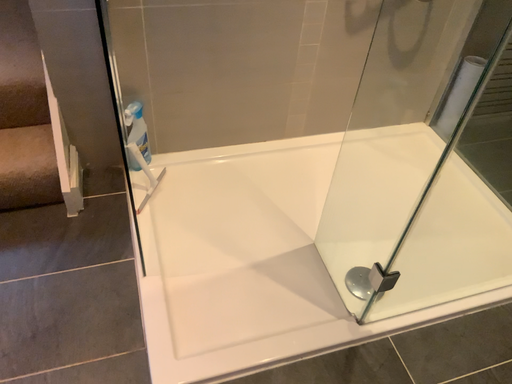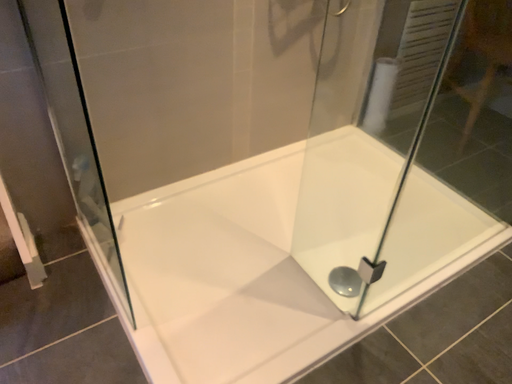
Question: How did the camera likely rotate when shooting the video?

Choices:
 (A) rotated left
 (B) rotated right

Answer: (B)